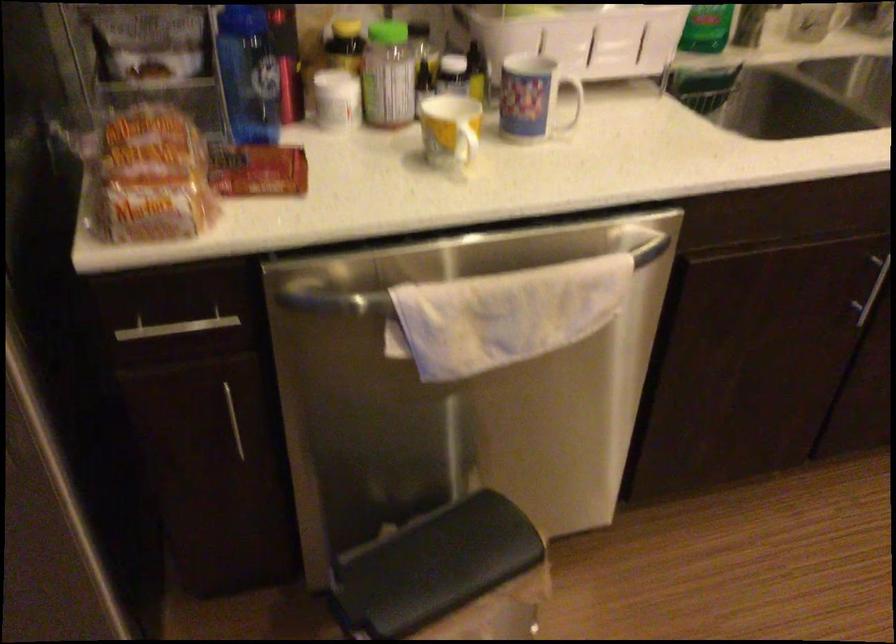
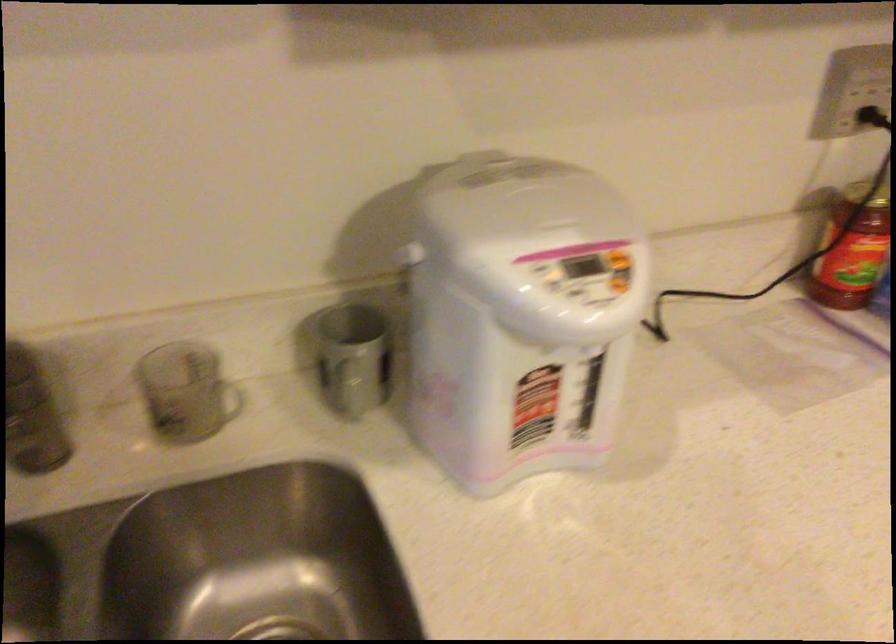
What movement of the cameraman would produce the second image?

The movement direction of the cameraman is right, forward.